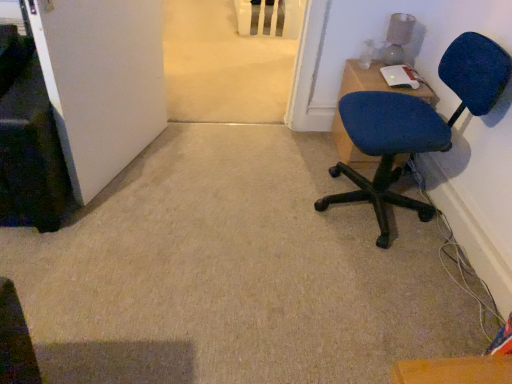
Where is `free space in front of blue fabric chair at upper right`? free space in front of blue fabric chair at upper right is located at coordinates (366, 177).